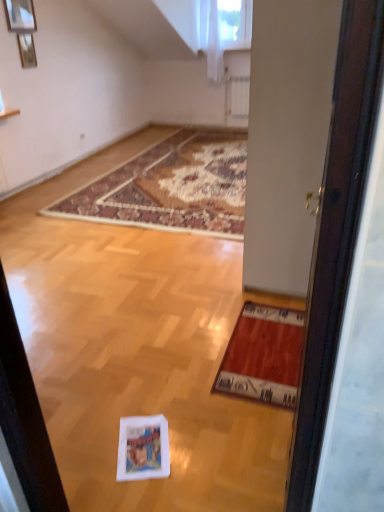
Where is `red fabric yoga mat at lower right`? The height and width of the screenshot is (512, 384). red fabric yoga mat at lower right is located at coordinates (263, 356).

Image resolution: width=384 pixels, height=512 pixels. What do you see at coordinates (263, 356) in the screenshot?
I see `red fabric yoga mat at lower right` at bounding box center [263, 356].

What is the approximate height of red fabric yoga mat at lower right?

It is 0.84 inches.

In the scene shown: In order to face red fabric yoga mat at lower right, should I rotate leftwards or rightwards?

Turn right approximately 10.246 degrees to face it.

The image size is (384, 512). In order to click on red fabric yoga mat at lower right in this screenshot , I will do `click(263, 356)`.